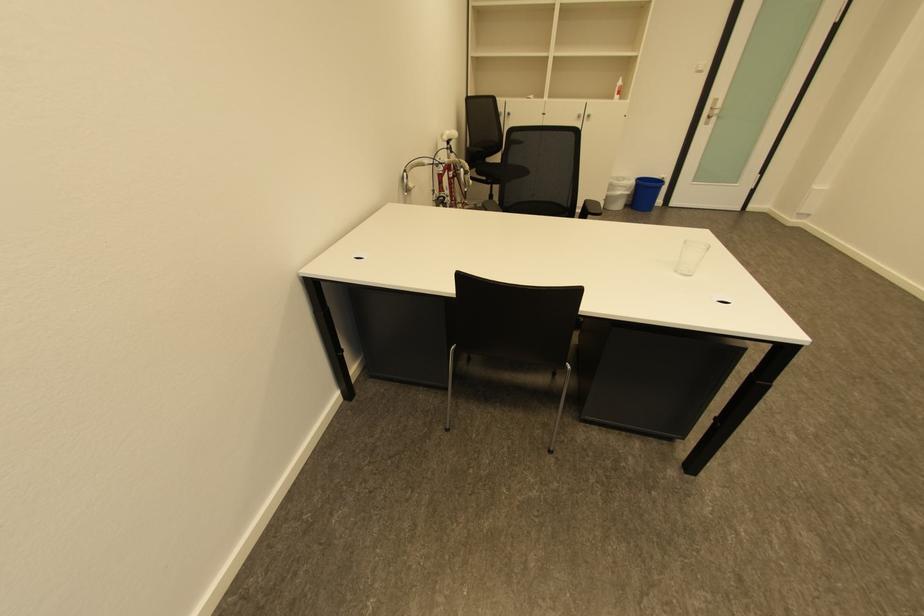
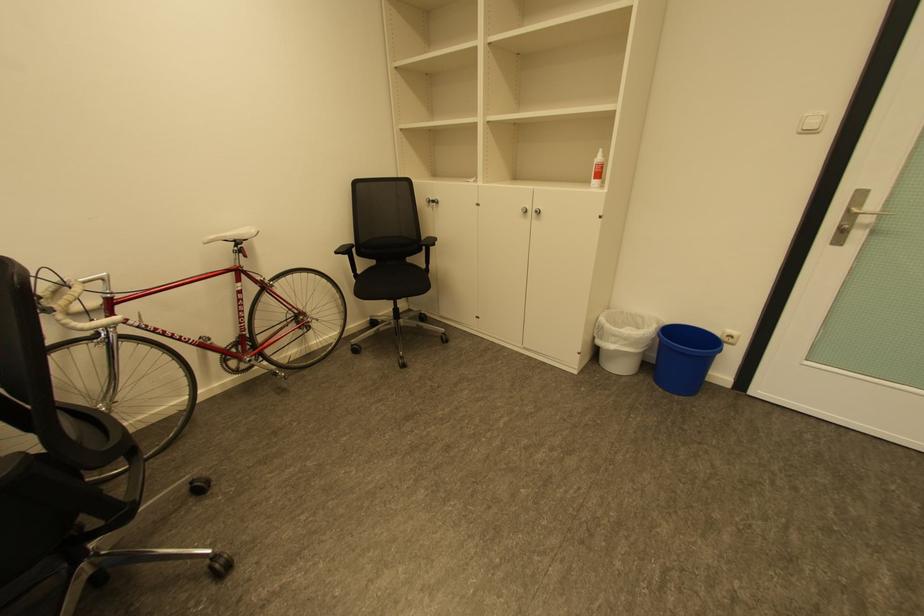
In the second image, find the point that corresponds to point 670,179 in the first image.

(737, 337)